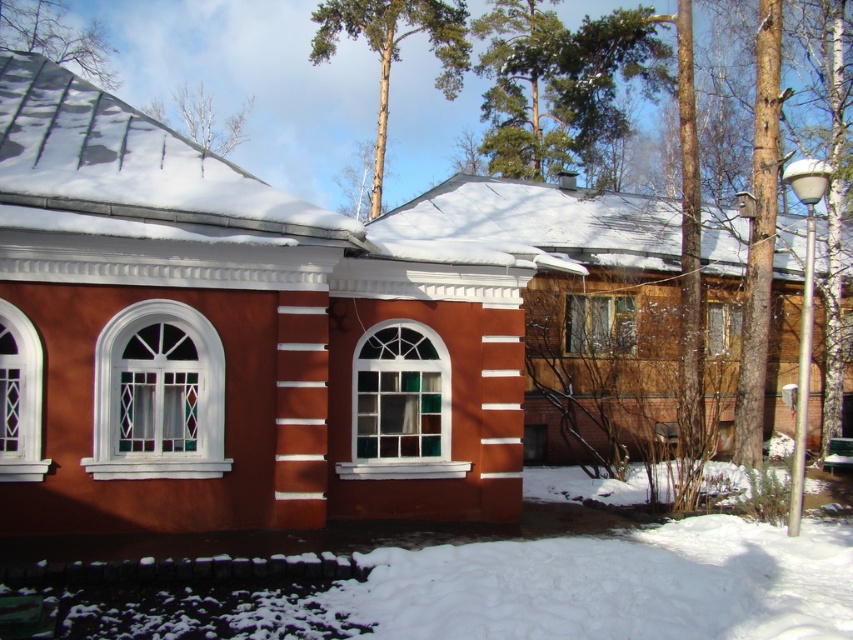
Question: Which point is closer to the camera taking this photo?

Choices:
 (A) (361, 442)
 (B) (55, 4)
 (C) (39, 468)
 (D) (711, 317)

Answer: (C)

Question: Which point is farther to the camera?

Choices:
 (A) (103, 448)
 (B) (381, 177)
 (C) (355, 371)
 (D) (163, 108)

Answer: (D)

Question: Does brown wood tree at upper center appear on the left side of white snow-covered tree at upper left?

Choices:
 (A) no
 (B) yes

Answer: (A)

Question: Can you confirm if green leafy tree at upper left is smaller than white snow-covered tree at upper left?

Choices:
 (A) no
 (B) yes

Answer: (A)

Question: Considering the relative positions of transparent glass window at center and clear glass window at center in the image provided, where is transparent glass window at center located with respect to clear glass window at center?

Choices:
 (A) above
 (B) below

Answer: (A)

Question: Which point is farther from the camera taking this photo?

Choices:
 (A) (579, 352)
 (B) (706, 324)
 (C) (4, 310)
 (D) (654, 61)

Answer: (D)